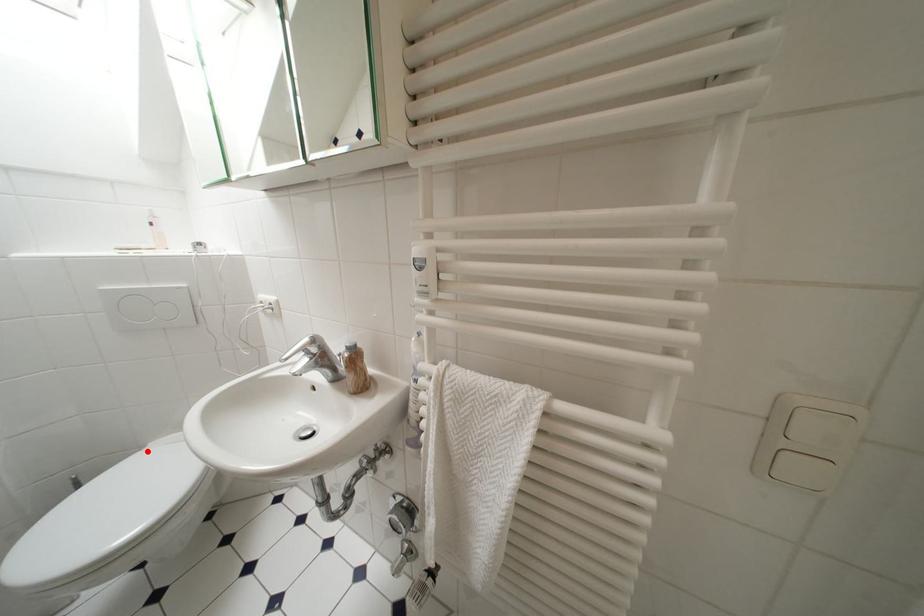
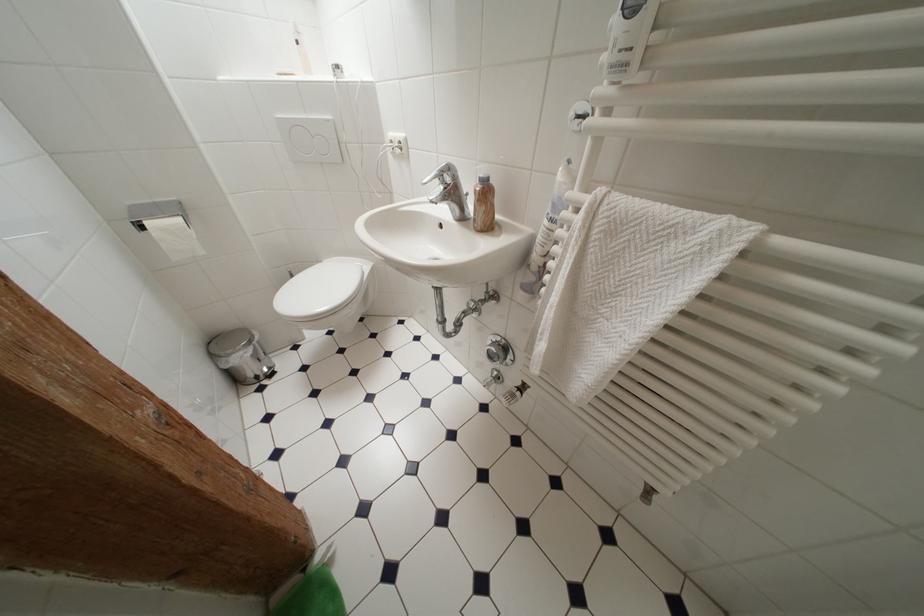
Question: A red point is marked in image1. In image2, is the corresponding 3D point closer to the camera or farther? Reply with the corresponding letter.

Choices:
 (A) The corresponding 3D point is closer.
 (B) The corresponding 3D point is farther.

Answer: (B)